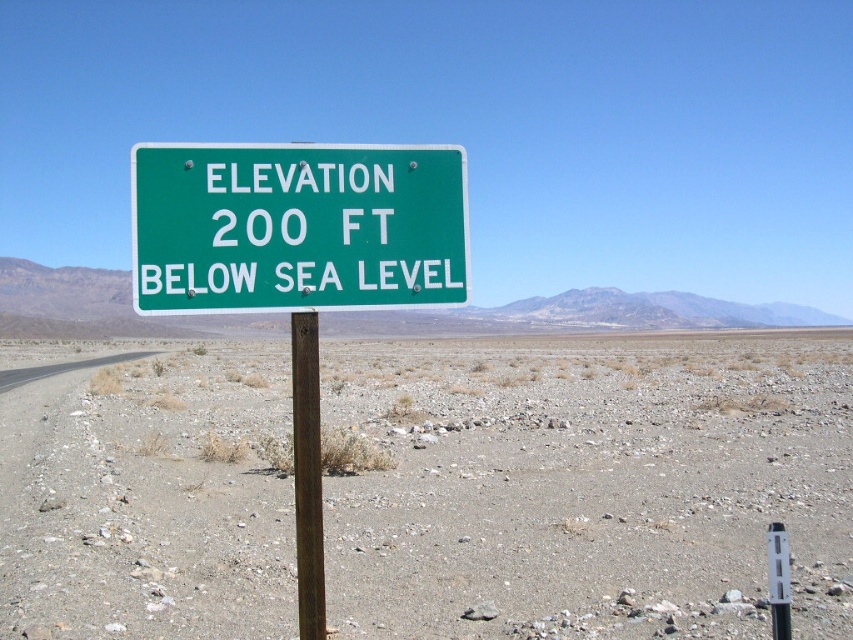
You are a delivery drone with a 36 inch wingspan. You need to fly between the green metal sign at center and the brown wooden post at center. Can you safely pass through the space between them?

The distance between the green metal sign at center and the brown wooden post at center is 39.10 inches. Since your wingspan is 36 inches, you have enough clearance to safely pass through the space between them.

You are a photographer setting up equipment near the green metal sign at center and the brown wooden post at center. You need to place a 10 cm wide tripod between them. Which object should you position the tripod closer to to ensure it fits within the available space?

The green metal sign at center is thinner than the brown wooden post at center, so you should position the tripod closer to the green metal sign at center to ensure it fits within the available space.

You are standing at the roadside sign and want to walk towards the gray gravel desert at center. Which direction should you move relative to the brown wooden post at center?

Since the brown wooden post at center is behind the gray gravel desert at center, you should move forward towards the gray gravel desert at center, which is in front of the brown wooden post at center.